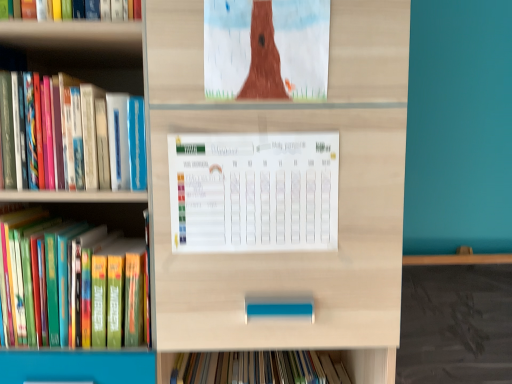
Where is `matte brown tree at upper center`? Image resolution: width=512 pixels, height=384 pixels. matte brown tree at upper center is located at coordinates (266, 49).

What do you see at coordinates (84, 137) in the screenshot? I see `hardcover book at left, placed as the second book when sorted from bottom to top` at bounding box center [84, 137].

Measure the distance between point (x=102, y=273) and camera.

The distance of point (x=102, y=273) from camera is 30.75 inches.

Find the location of a particular element. matte brown tree at upper center is located at coordinates (266, 49).

Considering the relative sizes of white paper calendar at center and matte brown tree at upper center in the image provided, is white paper calendar at center bigger than matte brown tree at upper center?

Yes.

Is point (275, 209) farther from viewer compared to point (317, 14)?

Yes, it is.

Which object is closer to the camera, white paper calendar at center or matte brown tree at upper center?

matte brown tree at upper center is closer to the camera.

From a real-world perspective, who is located higher, white paper calendar at center or matte brown tree at upper center?

matte brown tree at upper center, from a real-world perspective.

Considering the sizes of objects white paper calendar at center and hardcover book at left, placed as the second book when sorted from bottom to top, in the image provided, who is shorter, white paper calendar at center or hardcover book at left, placed as the second book when sorted from bottom to top,?

With less height is white paper calendar at center.

You are a GUI agent. You are given a task and a screenshot of the screen. Output one action in this format:
    pyautogui.click(x=<x>, y=<y>)
    Task: Click on the 1st book to the left when counting from the white paper calendar at center
    This screenshot has width=512, height=384.
    Given the screenshot: What is the action you would take?
    pyautogui.click(x=84, y=137)

Between white paper calendar at center and hardcover book at left, the 1th book viewed from the top, which one has larger size?

With larger size is hardcover book at left, the 1th book viewed from the top.

In the scene shown: Is white paper calendar at center at the right side of hardcover book at left, placed as the second book when sorted from bottom to top?

Indeed, white paper calendar at center is positioned on the right side of hardcover book at left, placed as the second book when sorted from bottom to top.

Which of these two, matte brown tree at upper center or hardcover book at left, which appears as the second book when viewed from the top, stands taller?

matte brown tree at upper center is taller.

Find the location of a particular element. The height and width of the screenshot is (384, 512). the 2nd book below when counting from the matte brown tree at upper center (from the image's perspective) is located at coordinates (72, 283).

Does point (307, 48) come behind point (106, 325)?

That is False.

Can you confirm if matte brown tree at upper center is positioned to the right of hardcover book at left, marked as the 1th book in a bottom-to-top arrangement?

Correct, you'll find matte brown tree at upper center to the right of hardcover book at left, marked as the 1th book in a bottom-to-top arrangement.

How different are the orientations of hardcover book at left, which appears as the second book when viewed from the top, and matte brown tree at upper center in degrees?

The angle between the facing direction of hardcover book at left, which appears as the second book when viewed from the top, and the facing direction of matte brown tree at upper center is 0.0108 degrees.

I want to click on book cover lying on the right of hardcover book at left, marked as the 1th book in a bottom-to-top arrangement, so (266, 49).

From a real-world perspective, is hardcover book at left, marked as the 1th book in a bottom-to-top arrangement, physically above matte brown tree at upper center?

No, from a real-world perspective, hardcover book at left, marked as the 1th book in a bottom-to-top arrangement, is not over matte brown tree at upper center

Between hardcover book at left, marked as the 1th book in a bottom-to-top arrangement, and matte brown tree at upper center, which one has smaller width?

With smaller width is matte brown tree at upper center.

Is point (245, 63) positioned before point (292, 194)?

Yes, point (245, 63) is in front of point (292, 194).

Is matte brown tree at upper center aimed at white paper calendar at center?

No, matte brown tree at upper center is not aimed at white paper calendar at center.

Based on the photo, from the image's perspective, between matte brown tree at upper center and white paper calendar at center, who is located below?

white paper calendar at center appears lower in the image.

Does point (56, 158) appear closer or farther from the camera than point (100, 339)?

Point (56, 158) is closer to the camera than point (100, 339).

Looking at their sizes, would you say hardcover book at left, placed as the second book when sorted from bottom to top, is wider or thinner than hardcover book at left, marked as the 1th book in a bottom-to-top arrangement?

hardcover book at left, placed as the second book when sorted from bottom to top, is thinner than hardcover book at left, marked as the 1th book in a bottom-to-top arrangement.

Is hardcover book at left, placed as the second book when sorted from bottom to top, far from hardcover book at left, marked as the 1th book in a bottom-to-top arrangement?

No, there isn't a large distance between hardcover book at left, placed as the second book when sorted from bottom to top, and hardcover book at left, marked as the 1th book in a bottom-to-top arrangement.

In order to click on book in front of the hardcover book at left, which appears as the second book when viewed from the top in this screenshot , I will do `click(84, 137)`.

Does hardcover book at left, which appears as the second book when viewed from the top, touch white paper calendar at center?

There is a gap between hardcover book at left, which appears as the second book when viewed from the top, and white paper calendar at center.

Considering the relative positions of hardcover book at left, which appears as the second book when viewed from the top, and white paper calendar at center in the image provided, is hardcover book at left, which appears as the second book when viewed from the top, behind white paper calendar at center?

That is True.

Looking at this image, is hardcover book at left, marked as the 1th book in a bottom-to-top arrangement, aimed at white paper calendar at center?

No, hardcover book at left, marked as the 1th book in a bottom-to-top arrangement, is not facing towards white paper calendar at center.

Between hardcover book at left, which appears as the second book when viewed from the top, and white paper calendar at center, which one appears on the left side from the viewer's perspective?

hardcover book at left, which appears as the second book when viewed from the top.

Identify the location of book cover above the white paper calendar at center (from a real-world perspective). The height and width of the screenshot is (384, 512). (266, 49).

Find the location of a particular element. This screenshot has height=384, width=512. the 1st book counting from the left side of the white paper calendar at center is located at coordinates (84, 137).

When comparing their distances from hardcover book at left, the 1th book viewed from the top, does matte brown tree at upper center or white paper calendar at center seem closer?

white paper calendar at center is positioned closer to the anchor hardcover book at left, the 1th book viewed from the top.

Estimate the real-world distances between objects in this image. Which object is closer to matte brown tree at upper center, hardcover book at left, which appears as the second book when viewed from the top, or white paper calendar at center?

Among the two, white paper calendar at center is located nearer to matte brown tree at upper center.

Based on their spatial positions, is hardcover book at left, which appears as the second book when viewed from the top, or matte brown tree at upper center further from white paper calendar at center?

Based on the image, hardcover book at left, which appears as the second book when viewed from the top, appears to be further to white paper calendar at center.

From the image, which object appears to be nearer to matte brown tree at upper center, hardcover book at left, placed as the second book when sorted from bottom to top, or white paper calendar at center?

Among the two, white paper calendar at center is located nearer to matte brown tree at upper center.

Looking at this image, considering their positions, is white paper calendar at center positioned closer to hardcover book at left, marked as the 1th book in a bottom-to-top arrangement, than hardcover book at left, placed as the second book when sorted from bottom to top?

Among the two, hardcover book at left, placed as the second book when sorted from bottom to top, is located nearer to hardcover book at left, marked as the 1th book in a bottom-to-top arrangement.

When comparing their distances from matte brown tree at upper center, does hardcover book at left, the 1th book viewed from the top, or hardcover book at left, which appears as the second book when viewed from the top, seem closer?

Based on the image, hardcover book at left, the 1th book viewed from the top, appears to be nearer to matte brown tree at upper center.

Considering their positions, is white paper calendar at center positioned further to hardcover book at left, placed as the second book when sorted from bottom to top, than hardcover book at left, marked as the 1th book in a bottom-to-top arrangement?

white paper calendar at center is positioned further to the anchor hardcover book at left, placed as the second book when sorted from bottom to top.

Estimate the real-world distances between objects in this image. Which object is closer to matte brown tree at upper center, white paper calendar at center or hardcover book at left, which appears as the second book when viewed from the top?

white paper calendar at center lies closer to matte brown tree at upper center than the other object.

Identify the location of paperback book between hardcover book at left, placed as the second book when sorted from bottom to top, and matte brown tree at upper center from left to right. Image resolution: width=512 pixels, height=384 pixels. (254, 192).

This screenshot has height=384, width=512. In order to click on paperback book between matte brown tree at upper center and hardcover book at left, which appears as the second book when viewed from the top, in the up-down direction in this screenshot , I will do `click(254, 192)`.

I want to click on book between matte brown tree at upper center and hardcover book at left, marked as the 1th book in a bottom-to-top arrangement, vertically, so click(x=84, y=137).

Identify the location of book located between hardcover book at left, marked as the 1th book in a bottom-to-top arrangement, and white paper calendar at center in the left-right direction. (84, 137).